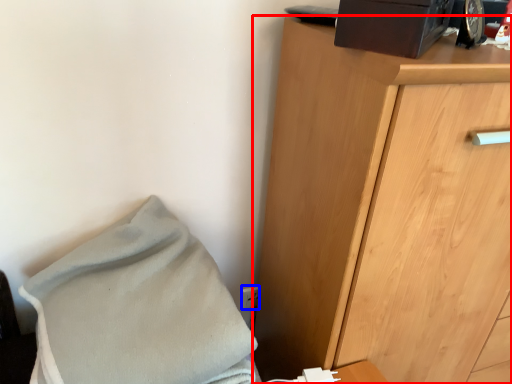
Question: Which point is closer to the camera, chest of drawers (highlighted by a red box) or electric outlet (highlighted by a blue box)?

Choices:
 (A) chest of drawers
 (B) electric outlet

Answer: (A)